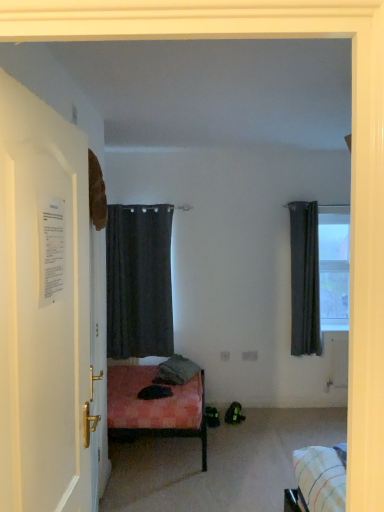
Question: In the image, is transparent glass window at upper right positioned in front of or behind white paper at left?

Choices:
 (A) front
 (B) behind

Answer: (B)

Question: From their relative heights in the image, would you say transparent glass window at upper right is taller or shorter than white paper at left?

Choices:
 (A) short
 (B) tall

Answer: (A)

Question: Which object is the farthest from the dark gray fabric curtain at right, the 2th curtain when ordered from left to right?

Choices:
 (A) white paper at left
 (B) dark matte curtain at center, arranged as the 2th curtain when viewed from the right
 (C) gray fabric pillow at center
 (D) transparent glass window at upper right

Answer: (A)

Question: Based on their relative distances, which object is farther from the gray fabric pillow at center?

Choices:
 (A) dark matte curtain at center, arranged as the 2th curtain when viewed from the right
 (B) white paper at left
 (C) dark gray fabric curtain at right, which is the first curtain from right to left
 (D) transparent glass window at upper right

Answer: (B)